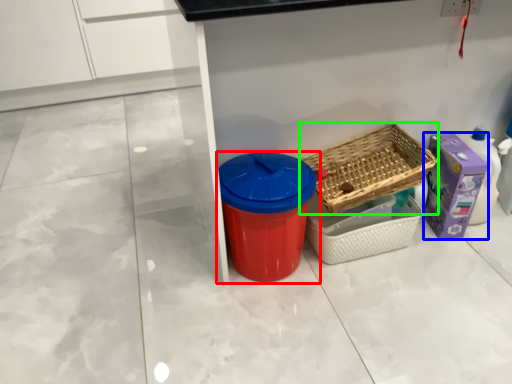
Question: Considering the real-world distances, which object is farthest from waste container (highlighted by a red box)? storage box (highlighted by a blue box) or basket (highlighted by a green box)?

Choices:
 (A) storage box
 (B) basket

Answer: (A)